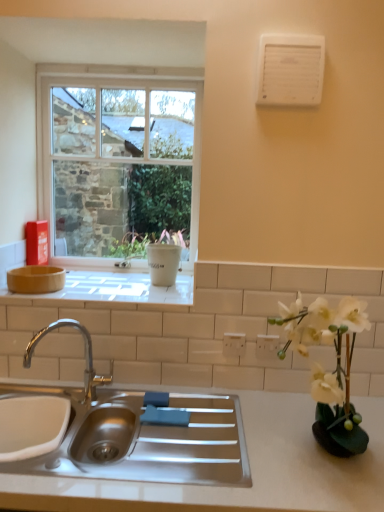
Find the location of a particular element. clear glass window at upper left is located at coordinates (117, 160).

In order to face white plastic electric outlet at upper center, the 2th electric outlet when ordered from left to right, should I rotate leftwards or rightwards?

Turn right approximately 10.257 degrees to face it.

Image resolution: width=384 pixels, height=512 pixels. Describe the element at coordinates (250, 468) in the screenshot. I see `white matte countertop at center` at that location.

What are the coordinates of `white matte countertop at center` in the screenshot? It's located at (250, 468).

Locate an element on the screen. The height and width of the screenshot is (512, 384). stainless steel sink at center is located at coordinates (138, 431).

Describe the element at coordinates (138, 431) in the screenshot. I see `stainless steel sink at center` at that location.

The height and width of the screenshot is (512, 384). Find the location of `clear glass window at upper left`. clear glass window at upper left is located at coordinates (117, 160).

Is white plastic electric outlet at upper center, the 1th electric outlet in the right-to-left sequence, thinner than white matte vase at upper center?

Indeed, white plastic electric outlet at upper center, the 1th electric outlet in the right-to-left sequence, has a lesser width compared to white matte vase at upper center.

Does point (277, 338) come behind point (163, 266)?

No, (277, 338) is in front of (163, 266).

Does white plastic electric outlet at upper center, the 2th electric outlet when ordered from left to right, turn towards white matte vase at upper center?

No, white plastic electric outlet at upper center, the 2th electric outlet when ordered from left to right, is not oriented towards white matte vase at upper center.

Where is `countertop to the right of clear glass window at upper left`? This screenshot has width=384, height=512. countertop to the right of clear glass window at upper left is located at coordinates (250, 468).

Which is closer, [378,404] or [184,243]?

Point [378,404] appears to be closer to the viewer than point [184,243].

Which object is more forward, white matte countertop at center or clear glass window at upper left?

white matte countertop at center is closer to the camera.

Is white matte countertop at center taller or shorter than clear glass window at upper left?

Considering their sizes, white matte countertop at center has less height than clear glass window at upper left.

Is clear glass window at upper left not near white plastic electric outlet at upper center, the 1th electric outlet in the right-to-left sequence?

That's right, there is a large distance between clear glass window at upper left and white plastic electric outlet at upper center, the 1th electric outlet in the right-to-left sequence.

Considering the sizes of clear glass window at upper left and white plastic electric outlet at upper center, the 2th electric outlet when ordered from left to right, in the image, is clear glass window at upper left wider or thinner than white plastic electric outlet at upper center, the 2th electric outlet when ordered from left to right,?

Clearly, clear glass window at upper left has more width compared to white plastic electric outlet at upper center, the 2th electric outlet when ordered from left to right.

Which object is more forward, clear glass window at upper left or white plastic electric outlet at upper center, the 2th electric outlet when ordered from left to right?

white plastic electric outlet at upper center, the 2th electric outlet when ordered from left to right, is closer to the camera.

In the scene shown: Does clear glass window at upper left turn towards white plastic electric outlet at upper center, the 1th electric outlet in the right-to-left sequence?

No, clear glass window at upper left does not turn towards white plastic electric outlet at upper center, the 1th electric outlet in the right-to-left sequence.

Can you confirm if white plastic air conditioner at upper right is shorter than stainless steel sink at center?

Yes.

Considering the positions of objects white plastic air conditioner at upper right and stainless steel sink at center in the image provided, who is more to the left, white plastic air conditioner at upper right or stainless steel sink at center?

stainless steel sink at center is more to the left.

Is white plastic air conditioner at upper right far away from stainless steel sink at center?

Yes, white plastic air conditioner at upper right and stainless steel sink at center are quite far apart.

In the image, there is a white plastic air conditioner at upper right. Identify the location of sink below it (from the image's perspective). This screenshot has width=384, height=512. (138, 431).

Which is behind, point (233, 355) or point (8, 486)?

Positioned behind is point (233, 355).

Considering the sizes of objects white plastic electric outlet at center, placed as the second electric outlet when sorted from right to left, and white matte countertop at center in the image provided, who is thinner, white plastic electric outlet at center, placed as the second electric outlet when sorted from right to left, or white matte countertop at center?

white plastic electric outlet at center, placed as the second electric outlet when sorted from right to left, is thinner.

Is white plastic electric outlet at center, which is the first electric outlet from left to right, positioned beyond the bounds of white matte countertop at center?

That's correct, white plastic electric outlet at center, which is the first electric outlet from left to right, is outside of white matte countertop at center.

From a real-world perspective, is white plastic electric outlet at center, placed as the second electric outlet when sorted from right to left, located higher than white matte countertop at center?

Yes.

Is clear glass window at upper left in front of or behind white plastic air conditioner at upper right in the image?

clear glass window at upper left is positioned farther from the viewer than white plastic air conditioner at upper right.

The width and height of the screenshot is (384, 512). Identify the location of air conditioner on the right of clear glass window at upper left. (290, 69).

How different are the orientations of clear glass window at upper left and white plastic air conditioner at upper right in degrees?

The facing directions of clear glass window at upper left and white plastic air conditioner at upper right are 1.65 degrees apart.

Which point is more distant from viewer, (257, 89) or (243, 348)?

The point (243, 348) is farther from the camera.

Looking at this image, considering the relative sizes of white plastic air conditioner at upper right and white plastic electric outlet at center, placed as the second electric outlet when sorted from right to left, in the image provided, is white plastic air conditioner at upper right taller than white plastic electric outlet at center, placed as the second electric outlet when sorted from right to left,?

Yes.

Considering the relative sizes of white plastic air conditioner at upper right and white plastic electric outlet at center, placed as the second electric outlet when sorted from right to left, in the image provided, is white plastic air conditioner at upper right thinner than white plastic electric outlet at center, placed as the second electric outlet when sorted from right to left,?

Incorrect, the width of white plastic air conditioner at upper right is not less than that of white plastic electric outlet at center, placed as the second electric outlet when sorted from right to left.

Which is more to the left, white plastic air conditioner at upper right or white plastic electric outlet at center, which is the first electric outlet from left to right?

Positioned to the left is white plastic electric outlet at center, which is the first electric outlet from left to right.

At what (x,y) coordinates should I click in order to perform the action: click on flowerpot lying above the white plastic electric outlet at upper center, the 2th electric outlet when ordered from left to right (from the image's perspective). Please return your answer as a coordinate pair (x, y). This screenshot has width=384, height=512. Looking at the image, I should click on (163, 263).

Identify the location of window positioned vertically above the white matte countertop at center (from a real-world perspective). The image size is (384, 512). (117, 160).

Estimate the real-world distances between objects in this image. Which object is further from white plastic electric outlet at center, placed as the second electric outlet when sorted from right to left, white matte vase at right or matte white tile at upper center?

matte white tile at upper center lies further to white plastic electric outlet at center, placed as the second electric outlet when sorted from right to left, than the other object.

When comparing their distances from white plastic electric outlet at upper center, the 2th electric outlet when ordered from left to right, does clear glass window at upper left or white matte vase at right seem closer?

white matte vase at right.

Which object lies nearer to the anchor point white plastic electric outlet at center, placed as the second electric outlet when sorted from right to left, clear glass window at upper left or white matte vase at right?

Based on the image, white matte vase at right appears to be nearer to white plastic electric outlet at center, placed as the second electric outlet when sorted from right to left.

Looking at this image, which object lies further to the anchor point clear glass window at upper left, white matte vase at right or stainless steel sink at center?

white matte vase at right lies further to clear glass window at upper left than the other object.

Looking at the image, which one is located closer to white plastic air conditioner at upper right, matte white tile at upper center or white plastic electric outlet at center, which is the first electric outlet from left to right?

matte white tile at upper center.

From the image, which object appears to be farther from white plastic air conditioner at upper right, white matte vase at right or white matte countertop at center?

white matte countertop at center.

Looking at the image, which one is located closer to white matte countertop at center, white matte vase at upper center or matte white tile at upper center?

matte white tile at upper center lies closer to white matte countertop at center than the other object.

Looking at the image, which one is located closer to white plastic electric outlet at upper center, the 1th electric outlet in the right-to-left sequence, white plastic electric outlet at center, placed as the second electric outlet when sorted from right to left, or white plastic air conditioner at upper right?

white plastic electric outlet at center, placed as the second electric outlet when sorted from right to left.

What are the coordinates of `window between white plastic air conditioner at upper right and white plastic electric outlet at upper center, the 1th electric outlet in the right-to-left sequence, in the vertical direction` in the screenshot? It's located at click(x=117, y=160).

I want to click on flowerpot between clear glass window at upper left and white plastic electric outlet at upper center, the 1th electric outlet in the right-to-left sequence, in the vertical direction, so click(163, 263).

Find the location of a particular element. Image resolution: width=384 pixels, height=512 pixels. window sill between clear glass window at upper left and white plastic electric outlet at center, which is the first electric outlet from left to right, in the up-down direction is located at coordinates (115, 289).

Image resolution: width=384 pixels, height=512 pixels. Identify the location of flowerpot between white plastic air conditioner at upper right and white matte countertop at center from top to bottom. (163, 263).